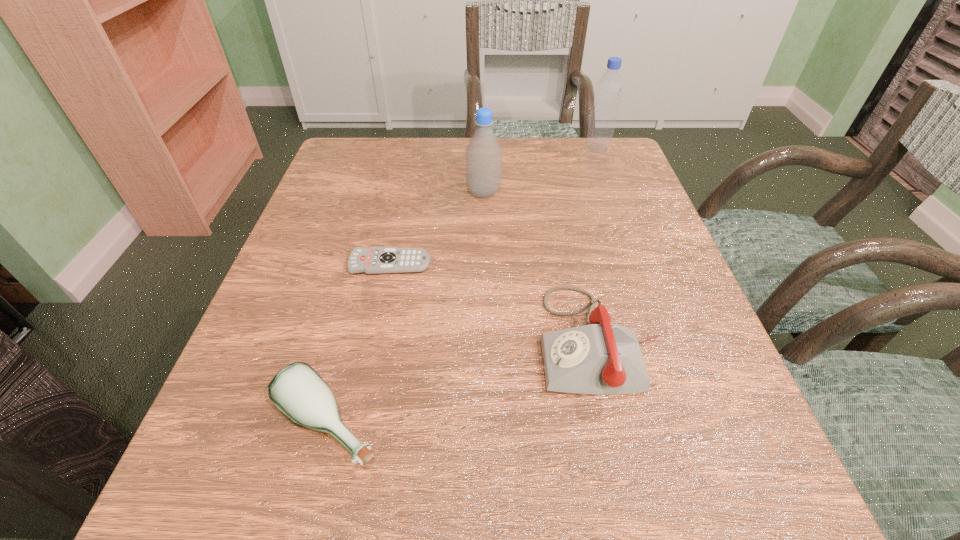
Where is `telephone that is positioned at the right edge`? telephone that is positioned at the right edge is located at coordinates (598, 358).

Locate an element on the screen. object present at the near left corner is located at coordinates (297, 390).

The width and height of the screenshot is (960, 540). What are the coordinates of `object present at the far right corner` in the screenshot? It's located at (609, 88).

You are a GUI agent. You are given a task and a screenshot of the screen. Output one action in this format:
    pyautogui.click(x=<x>, y=<y>)
    Task: Click on the vacant space at the far edge of the desktop
    The width and height of the screenshot is (960, 540).
    Given the screenshot: What is the action you would take?
    pyautogui.click(x=433, y=170)

Locate an element on the screen. vacant space at the near edge of the desktop is located at coordinates (423, 517).

The height and width of the screenshot is (540, 960). In order to click on vacant space at the left edge in this screenshot , I will do `click(283, 457)`.

What are the coordinates of `vacant region at the right edge of the desktop` in the screenshot? It's located at (750, 443).

The image size is (960, 540). Identify the location of vacant position at the far left corner of the desktop. (369, 170).

Identify the location of vacant space at the near left corner of the desktop. This screenshot has width=960, height=540. (273, 515).

The image size is (960, 540). In order to click on vacant space in between the second farthest bottle and the rightmost bottle in this screenshot , I will do `click(540, 170)`.